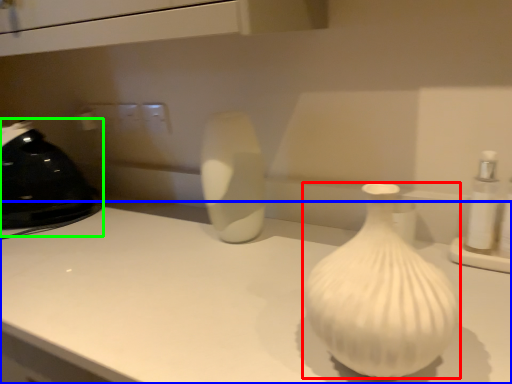
Question: Which object is positioned closest to vase (highlighted by a red box)? Select from counter top (highlighted by a blue box) and appliance (highlighted by a green box).

Choices:
 (A) counter top
 (B) appliance

Answer: (A)